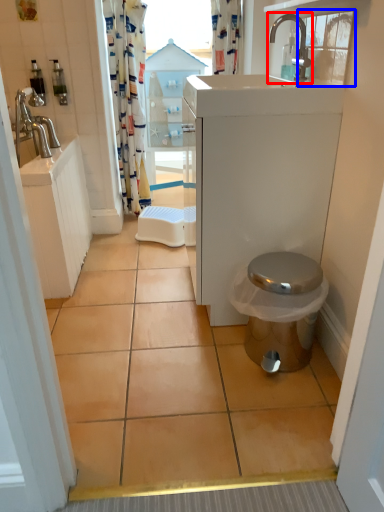
Question: Which of the following is the closest to the observer, tap (highlighted by a red box) or window (highlighted by a blue box)?

Choices:
 (A) tap
 (B) window

Answer: (B)